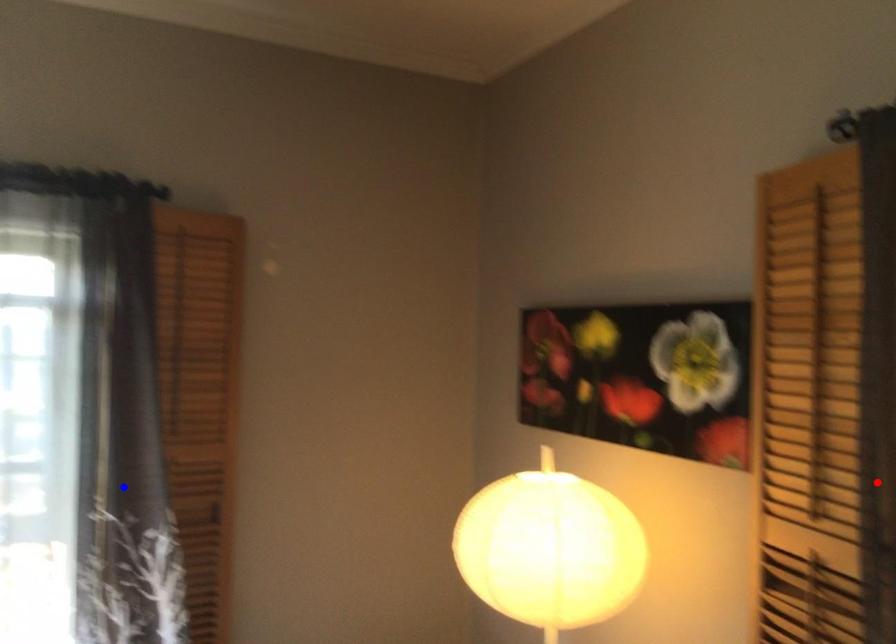
Question: In the image, two points are highlighted. Which point is nearer to the camera? Reply with the corresponding letter.

Choices:
 (A) blue point
 (B) red point

Answer: (B)